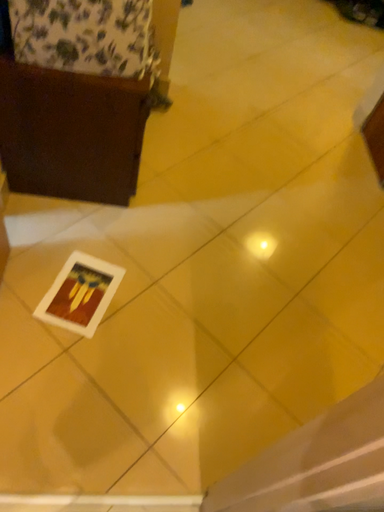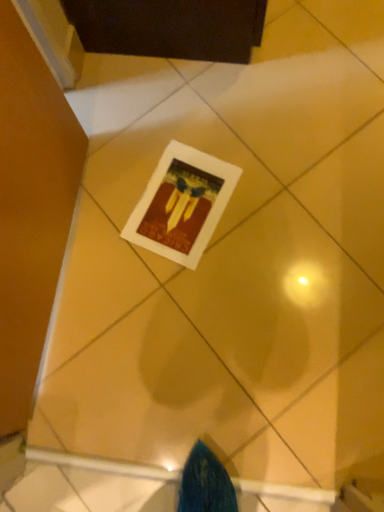
Question: Which way did the camera rotate in the video?

Choices:
 (A) rotated left
 (B) rotated right

Answer: (A)